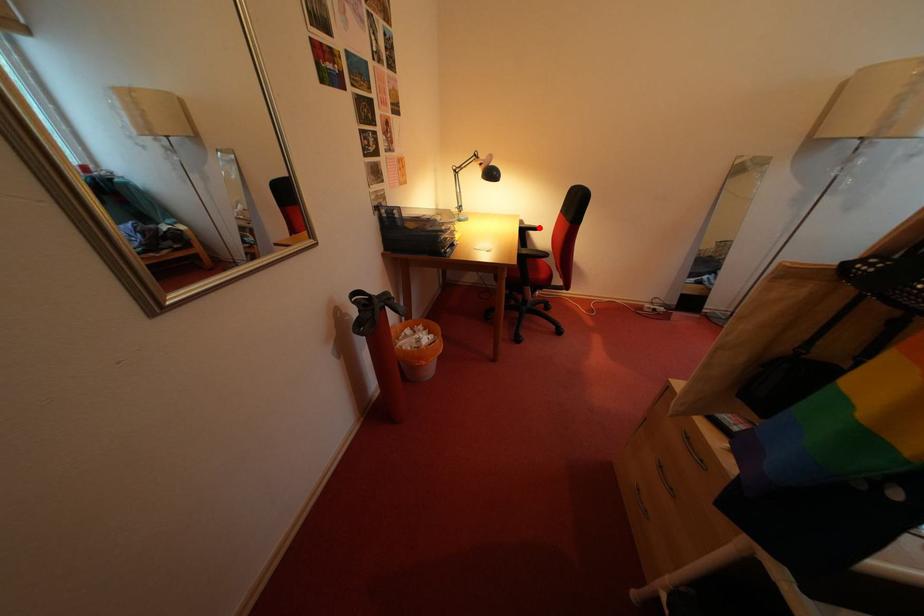
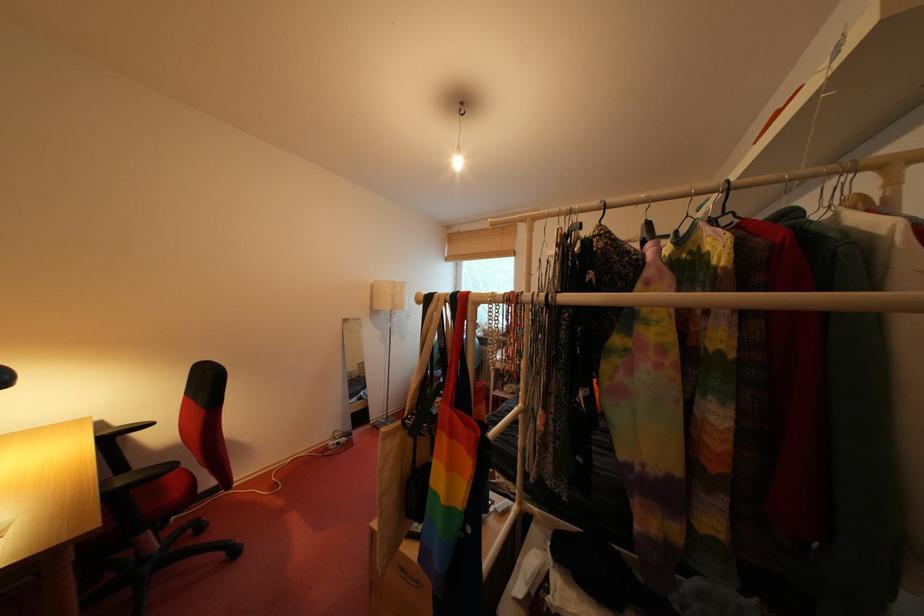
The point at the highlighted location is marked in the first image. Where is the corresponding point in the second image?

(131, 426)